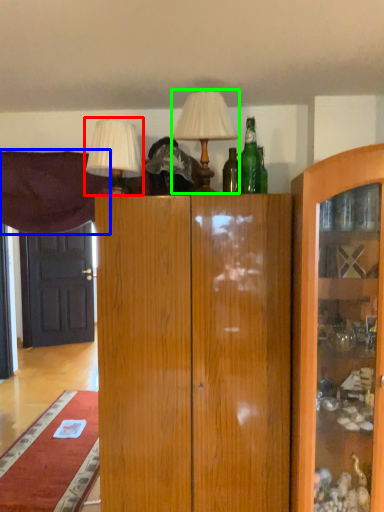
Question: Which object is the closest to the table lamp (highlighted by a red box)? Choose among these: curtain (highlighted by a blue box) or table lamp (highlighted by a green box).

Choices:
 (A) curtain
 (B) table lamp

Answer: (B)